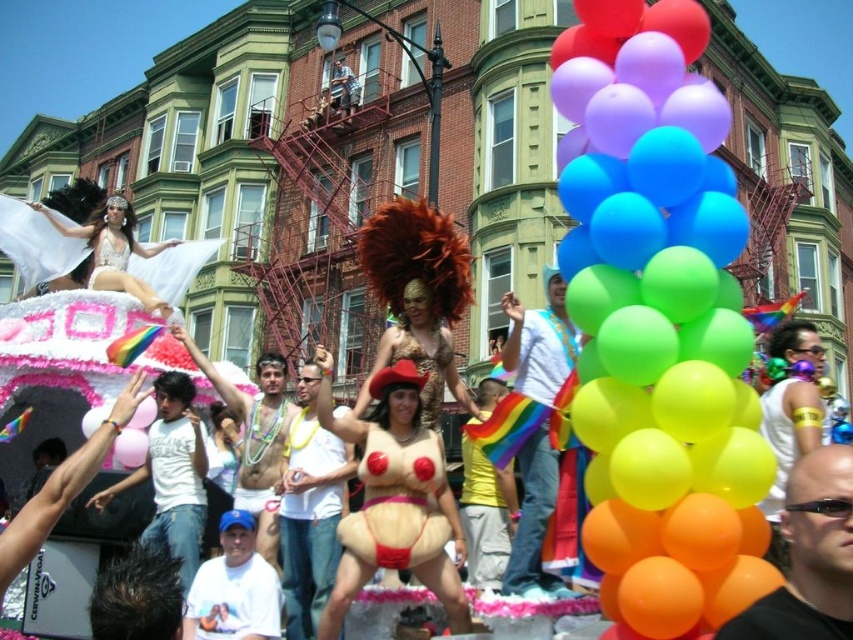
You are standing at the point with coordinates closest to the float in the Pride parade image. There are two points marked in the scene, one at coordinates point (369,512) and another at point (96,278). Which point is closer to you?

Point (369,512) is in front of point (96,278), so the point closer to you is point (369,512).

You are a photographer at the Pride parade. You want to capture a photo where both the rubber balloons at center and the white lace dress at upper left are visible. Considering their sizes, which object should you focus on to ensure both are in frame?

The rubber balloons at center are larger than the white lace dress at upper left. To ensure both are in frame, focus on the rubber balloons at center as they take up more space, allowing the smaller white lace dress at upper left to fit into the shot.